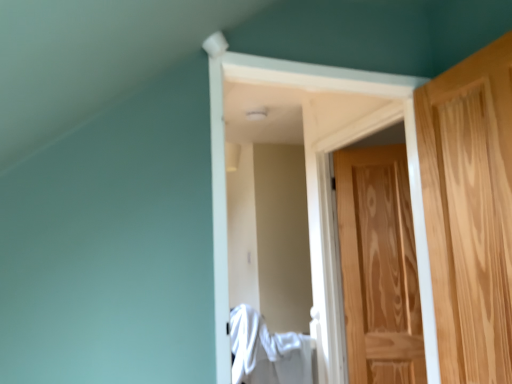
Question: Is white fabric at center turned away from light brown wood door at right, the second door positioned from the back?

Choices:
 (A) no
 (B) yes

Answer: (A)

Question: Considering the relative positions of white fabric at center and light brown wood door at right, the second door positioned from the back, in the image provided, is white fabric at center behind light brown wood door at right, the second door positioned from the back,?

Choices:
 (A) yes
 (B) no

Answer: (A)

Question: Does white fabric at center have a greater width compared to light brown wood door at right, positioned as the 1th door in front-to-back order?

Choices:
 (A) yes
 (B) no

Answer: (A)

Question: From a real-world perspective, is white fabric at center located higher than light brown wood door at right, positioned as the 1th door in front-to-back order?

Choices:
 (A) yes
 (B) no

Answer: (B)

Question: Is white fabric at center facing towards light brown wood door at right, the second door positioned from the back?

Choices:
 (A) no
 (B) yes

Answer: (B)

Question: From the image's perspective, is white fabric at center located beneath light brown wood door at right, positioned as the 1th door in front-to-back order?

Choices:
 (A) yes
 (B) no

Answer: (A)

Question: Can you confirm if natural wood door at right, which is the second door from front to back, is taller than light brown wood door at right, positioned as the 1th door in front-to-back order?

Choices:
 (A) yes
 (B) no

Answer: (A)

Question: Can you confirm if natural wood door at right, which is the second door from front to back, is thinner than light brown wood door at right, the second door positioned from the back?

Choices:
 (A) yes
 (B) no

Answer: (A)

Question: From a real-world perspective, is natural wood door at right, which appears as the 1th door when viewed from the back, physically below light brown wood door at right, the second door positioned from the back?

Choices:
 (A) yes
 (B) no

Answer: (A)

Question: From the image's perspective, is natural wood door at right, which appears as the 1th door when viewed from the back, located above light brown wood door at right, the second door positioned from the back?

Choices:
 (A) no
 (B) yes

Answer: (A)

Question: Is the position of natural wood door at right, which is the second door from front to back, more distant than that of light brown wood door at right, positioned as the 1th door in front-to-back order?

Choices:
 (A) yes
 (B) no

Answer: (A)

Question: Can you confirm if natural wood door at right, which is the second door from front to back, is smaller than light brown wood door at right, positioned as the 1th door in front-to-back order?

Choices:
 (A) yes
 (B) no

Answer: (A)

Question: Is natural wood door at right, which appears as the 1th door when viewed from the back, looking in the opposite direction of white fabric at center?

Choices:
 (A) yes
 (B) no

Answer: (B)